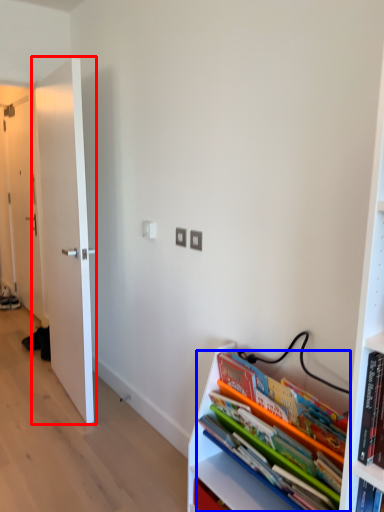
Question: Which point is further to the camera, door (highlighted by a red box) or book (highlighted by a blue box)?

Choices:
 (A) door
 (B) book

Answer: (A)